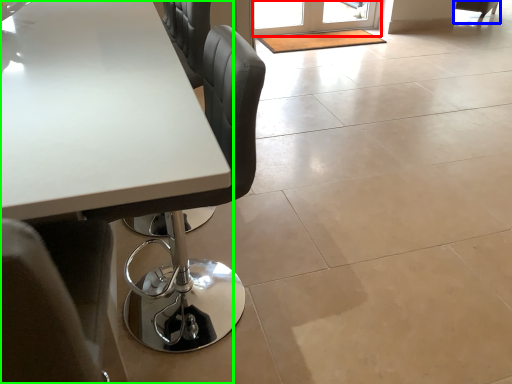
Question: Considering the real-world distances, which object is farthest from screen door (highlighted by a red box)? chair (highlighted by a blue box) or table (highlighted by a green box)?

Choices:
 (A) chair
 (B) table

Answer: (B)